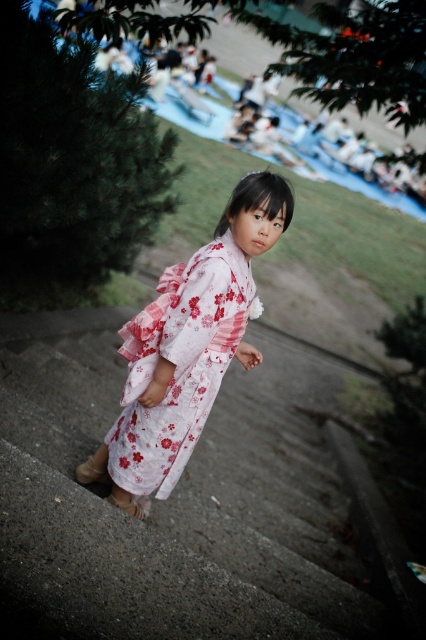
You are taking a photo of the girl in the kimono and want to focus on her face. The camera can only focus on one point at a time. Which point should you choose between point (48, 374) and point (244, 269) to ensure the girl is in focus?

Point (48, 374) is further to the camera than point (244, 269). To focus on the girl in the kimono, you should choose point (48, 374) because it is closer to the camera and thus more likely to be in focus.